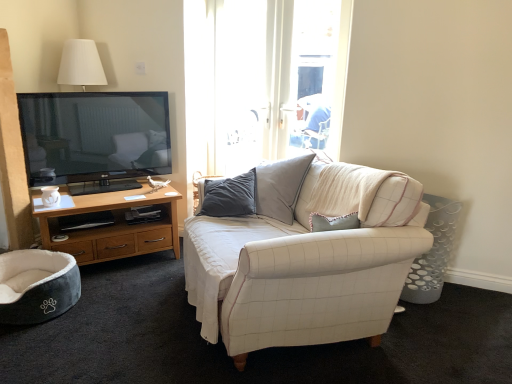
Question: Is wooden cabinet at left bigger than white fabric couch at center?

Choices:
 (A) yes
 (B) no

Answer: (B)

Question: From a real-world perspective, is wooden cabinet at left on white fabric couch at center?

Choices:
 (A) no
 (B) yes

Answer: (A)

Question: Is wooden cabinet at left completely or partially outside of white fabric couch at center?

Choices:
 (A) no
 (B) yes

Answer: (B)

Question: From the image's perspective, is wooden cabinet at left located above white fabric couch at center?

Choices:
 (A) no
 (B) yes

Answer: (A)

Question: Considering the relative positions of wooden cabinet at left and white fabric couch at center in the image provided, is wooden cabinet at left to the right of white fabric couch at center from the viewer's perspective?

Choices:
 (A) yes
 (B) no

Answer: (B)

Question: Does wooden cabinet at left turn towards white fabric couch at center?

Choices:
 (A) no
 (B) yes

Answer: (B)

Question: Can you see white fabric couch at center touching wooden cabinet at left?

Choices:
 (A) no
 (B) yes

Answer: (A)

Question: Does white fabric couch at center turn towards wooden cabinet at left?

Choices:
 (A) no
 (B) yes

Answer: (A)

Question: Is white fabric couch at center not near wooden cabinet at left?

Choices:
 (A) no
 (B) yes

Answer: (B)

Question: Is white fabric couch at center further to camera compared to wooden cabinet at left?

Choices:
 (A) no
 (B) yes

Answer: (A)

Question: Does white fabric couch at center appear on the left side of wooden cabinet at left?

Choices:
 (A) no
 (B) yes

Answer: (A)

Question: From the image's perspective, would you say white fabric couch at center is shown under wooden cabinet at left?

Choices:
 (A) yes
 (B) no

Answer: (B)

Question: Is the position of matte white coffee cup at left less distant than that of white fabric couch at center?

Choices:
 (A) yes
 (B) no

Answer: (B)